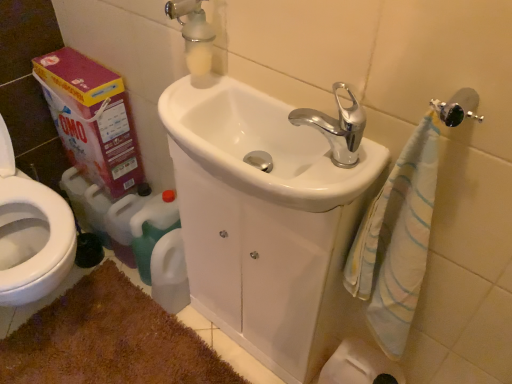
At what (x,y) coordinates should I click in order to perform the action: click on brown shaggy bath mat at lower left. Please return your answer as a coordinate pair (x, y). Looking at the image, I should click on (108, 340).

What do you see at coordinates (92, 119) in the screenshot? The height and width of the screenshot is (384, 512). I see `matte cardboard box at left` at bounding box center [92, 119].

Describe the element at coordinates (255, 268) in the screenshot. I see `white glossy sink at center` at that location.

Find the location of `brown shaggy bath mat at lower left`. brown shaggy bath mat at lower left is located at coordinates (108, 340).

Is white frosted glass soap dispenser at upper center inside white glossy sink at center?

No.

Is white glossy sink at center touching white frosted glass soap dispenser at upper center?

No, white glossy sink at center is not next to white frosted glass soap dispenser at upper center.

Is white frosted glass soap dispenser at upper center at the back of white glossy sink at center?

No, white glossy sink at center's orientation is not away from white frosted glass soap dispenser at upper center.

From the picture: From a real-world perspective, does white glossy sink at center stand above white frosted glass soap dispenser at upper center?

Incorrect, from a real-world perspective, white glossy sink at center is lower than white frosted glass soap dispenser at upper center.

Could you tell me if white glossy sink at center is facing chrome metallic faucet at upper center?

No, white glossy sink at center is not turned towards chrome metallic faucet at upper center.

Which of these two, white glossy sink at center or chrome metallic faucet at upper center, stands taller?

white glossy sink at center.

Which is nearer, (x=261, y=254) or (x=365, y=122)?

The point (x=365, y=122) is in front.

Does white glossy sink at center have a smaller size compared to chrome metallic faucet at upper center?

Incorrect, white glossy sink at center is not smaller in size than chrome metallic faucet at upper center.

From a real-world perspective, which is physically below, white glossy sink at center or white frosted glass soap dispenser at upper center?

white glossy sink at center is physically lower.

In the scene shown: Does white glossy sink at center have a smaller size compared to white frosted glass soap dispenser at upper center?

No.

Does point (320, 286) come closer to viewer compared to point (186, 25)?

No, (320, 286) is further to viewer.

What's the angular difference between white glossy sink at center and white frosted glass soap dispenser at upper center's facing directions?

white glossy sink at center and white frosted glass soap dispenser at upper center are facing 1.6 degrees away from each other.

Considering the relative positions of brown shaggy bath mat at lower left and white glossy sink at center in the image provided, is brown shaggy bath mat at lower left to the left of white glossy sink at center from the viewer's perspective?

Yes, brown shaggy bath mat at lower left is to the left of white glossy sink at center.

Considering the relative sizes of brown shaggy bath mat at lower left and white glossy sink at center in the image provided, is brown shaggy bath mat at lower left smaller than white glossy sink at center?

Indeed, brown shaggy bath mat at lower left has a smaller size compared to white glossy sink at center.

The image size is (512, 384). Identify the location of porcelain that appears in front of the brown shaggy bath mat at lower left. (255, 268).

Based on the photo, from a real-world perspective, is brown shaggy bath mat at lower left physically located above or below white glossy sink at center?

In terms of real-world spatial position, brown shaggy bath mat at lower left is below white glossy sink at center.

Is white glossy sink at center at the left side of chrome metallic faucet at upper center?

Yes, white glossy sink at center is to the left of chrome metallic faucet at upper center.

Considering the sizes of white glossy sink at center and chrome metallic faucet at upper center in the image, is white glossy sink at center wider or thinner than chrome metallic faucet at upper center?

In the image, white glossy sink at center appears to be wider than chrome metallic faucet at upper center.

Between point (248, 150) and point (350, 96), which one is positioned in front?

The point (350, 96) is closer.

Based on the photo, is chrome metallic faucet at upper center aimed at white glossy sink at center?

No.

The image size is (512, 384). I want to click on porcelain below the chrome metallic faucet at upper center (from the image's perspective), so click(255, 268).

Between chrome metallic faucet at upper center and white glossy sink at center, which one is positioned behind?

white glossy sink at center is behind.

How distant is chrome metallic faucet at upper center from white glossy sink at center?

chrome metallic faucet at upper center is 16.36 inches away from white glossy sink at center.

From the image's perspective, is chrome metallic faucet at upper center located above or below white glossy sink at center?

Clearly, from the image's perspective, chrome metallic faucet at upper center is above white glossy sink at center.

Is point (296, 119) closer to camera compared to point (301, 137)?

Yes, point (296, 119) is in front of point (301, 137).

From a real-world perspective, is chrome metallic faucet at upper center on top of white glossy sink at center?

Yes.

Can you confirm if chrome metallic faucet at upper center is positioned to the right of white glossy sink at center?

Indeed, chrome metallic faucet at upper center is positioned on the right side of white glossy sink at center.

The height and width of the screenshot is (384, 512). In order to click on sink lying in front of the white frosted glass soap dispenser at upper center in this screenshot , I will do `click(261, 144)`.

Where is `porcelain below the chrome metallic faucet at upper center (from the image's perspective)`? The image size is (512, 384). porcelain below the chrome metallic faucet at upper center (from the image's perspective) is located at coordinates (255, 268).

Considering their positions, is chrome metallic faucet at upper center positioned further to white glossy sink at center than matte cardboard box at left?

matte cardboard box at left is positioned further to the anchor white glossy sink at center.

Estimate the real-world distances between objects in this image. Which object is closer to brown shaggy bath mat at lower left, chrome metallic faucet at upper center or white glossy sink at center?

The object closer to brown shaggy bath mat at lower left is white glossy sink at center.

Based on their spatial positions, is white glossy sink at center or chrome metallic faucet at upper center closer to white glossy sink at center?

Among the two, chrome metallic faucet at upper center is located nearer to white glossy sink at center.

From the image, which object appears to be farther from brown shaggy bath mat at lower left, white frosted glass soap dispenser at upper center or white glossy sink at center?

The object further to brown shaggy bath mat at lower left is white frosted glass soap dispenser at upper center.

Estimate the real-world distances between objects in this image. Which object is further from chrome metallic faucet at upper center, matte cardboard box at left or brown shaggy bath mat at lower left?

Based on the image, brown shaggy bath mat at lower left appears to be further to chrome metallic faucet at upper center.

From the picture: Looking at the image, which one is located closer to chrome metallic faucet at upper center, white glossy sink at center or matte cardboard box at left?

The object closer to chrome metallic faucet at upper center is white glossy sink at center.

Considering their positions, is white frosted glass soap dispenser at upper center positioned closer to white glossy sink at center than matte cardboard box at left?

white frosted glass soap dispenser at upper center is closer to white glossy sink at center.

Looking at the image, which one is located closer to white glossy sink at center, matte cardboard box at left or white glossy sink at center?

The object closer to white glossy sink at center is white glossy sink at center.

Locate an element on the screen. carton between white frosted glass soap dispenser at upper center and brown shaggy bath mat at lower left vertically is located at coordinates (92, 119).

Find the location of a particular element. sink between chrome metallic faucet at upper center and brown shaggy bath mat at lower left in the up-down direction is located at coordinates [x=261, y=144].

At what (x,y) coordinates should I click in order to perform the action: click on plumbing fixture between matte cardboard box at left and white glossy sink at center from left to right. Please return your answer as a coordinate pair (x, y). The image size is (512, 384). Looking at the image, I should click on (194, 35).

You are a GUI agent. You are given a task and a screenshot of the screen. Output one action in this format:
    pyautogui.click(x=<x>, y=<y>)
    Task: Click on the sink between chrome metallic faucet at upper center and white glossy sink at center from top to bottom
    
    Given the screenshot: What is the action you would take?
    pyautogui.click(x=261, y=144)